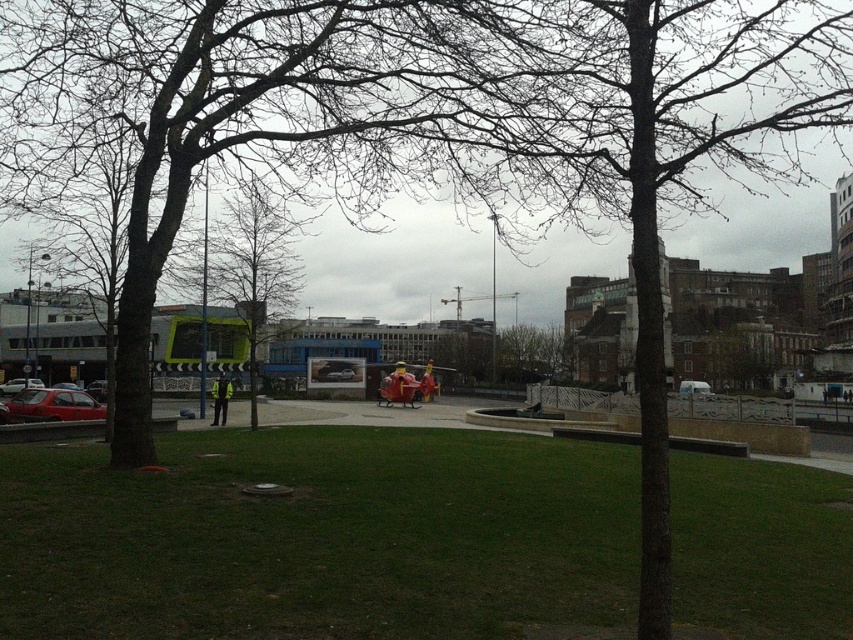
Is matte red car at lower left taller than white matte van at center?

No, matte red car at lower left is not taller than white matte van at center.

Locate an element on the screen. matte red car at lower left is located at coordinates (53, 404).

Who is more forward, (53, 570) or (212, 388)?

Point (53, 570) is in front.

Which is behind, point (544, 605) or point (219, 388)?

The point (219, 388) is behind.

Locate an element on the screen. green grass at center is located at coordinates (318, 536).

Can you confirm if matte red car at lower left is positioned to the left of high visibility yellow jacket at center?

Indeed, matte red car at lower left is positioned on the left side of high visibility yellow jacket at center.

Between matte red car at lower left and high visibility yellow jacket at center, which one is positioned higher?

matte red car at lower left

Image resolution: width=853 pixels, height=640 pixels. In order to click on matte red car at lower left in this screenshot , I will do `click(53, 404)`.

The image size is (853, 640). In order to click on matte red car at lower left in this screenshot , I will do `click(53, 404)`.